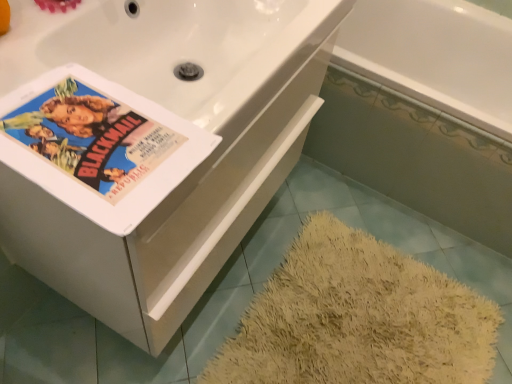
The width and height of the screenshot is (512, 384). Identify the location of vacant point above matte paper poster at upper left (from a real-world perspective). (93, 141).